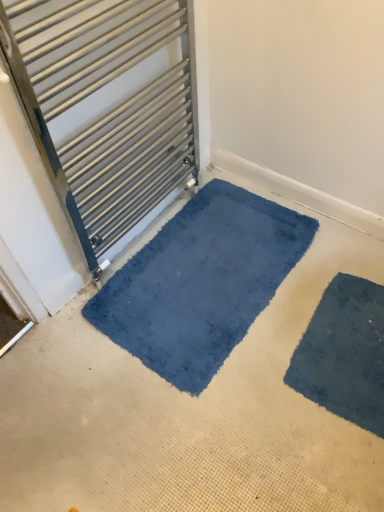
Identify the location of vacant region in front of blue plush mat at lower center. This screenshot has width=384, height=512. (198, 426).